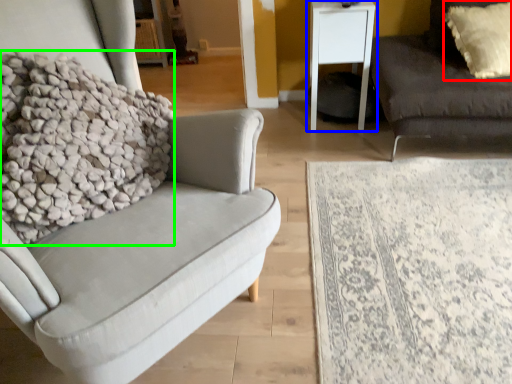
Question: Which object is the farthest from pillow (highlighted by a red box)? Choose among these: table (highlighted by a blue box) or blanket (highlighted by a green box).

Choices:
 (A) table
 (B) blanket

Answer: (B)